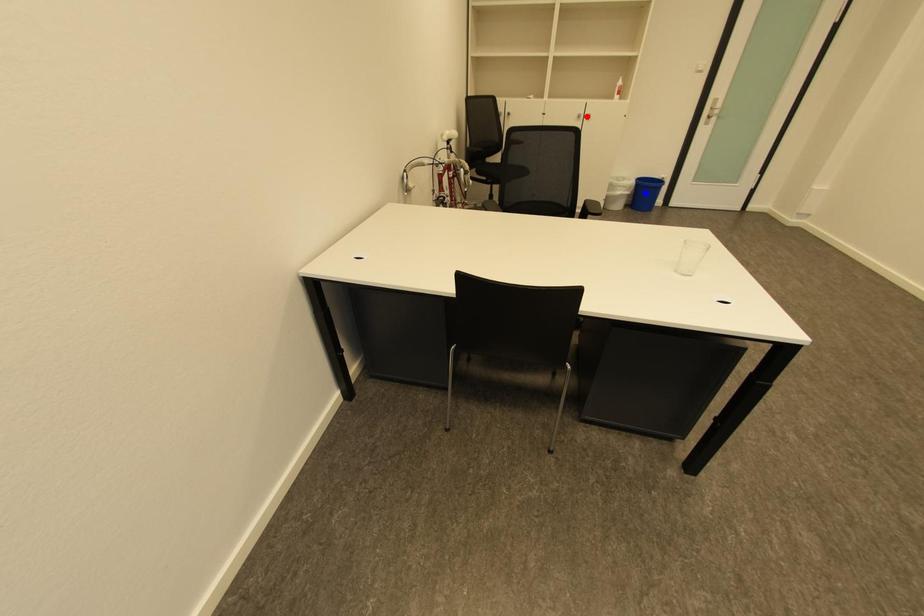
Question: Two points are marked on the image. Which point is closer to the camera?

Choices:
 (A) Blue point is closer.
 (B) Red point is closer.

Answer: (B)